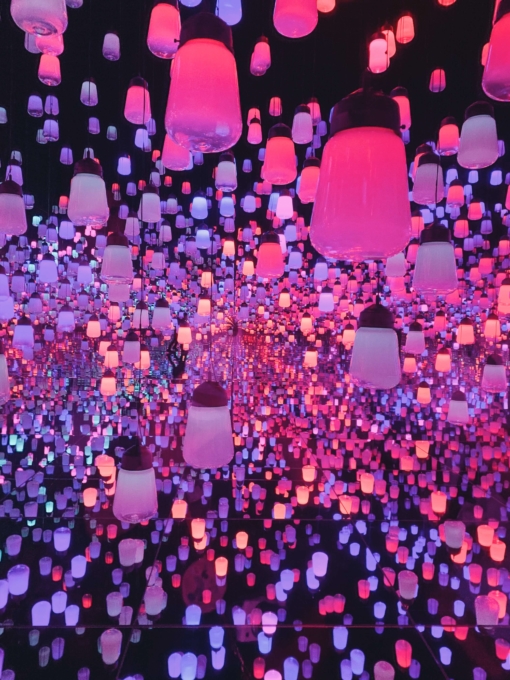
Where is `cluster of purple lights`? The height and width of the screenshot is (680, 510). cluster of purple lights is located at coordinates (55, 373), (85, 360), (60, 364).